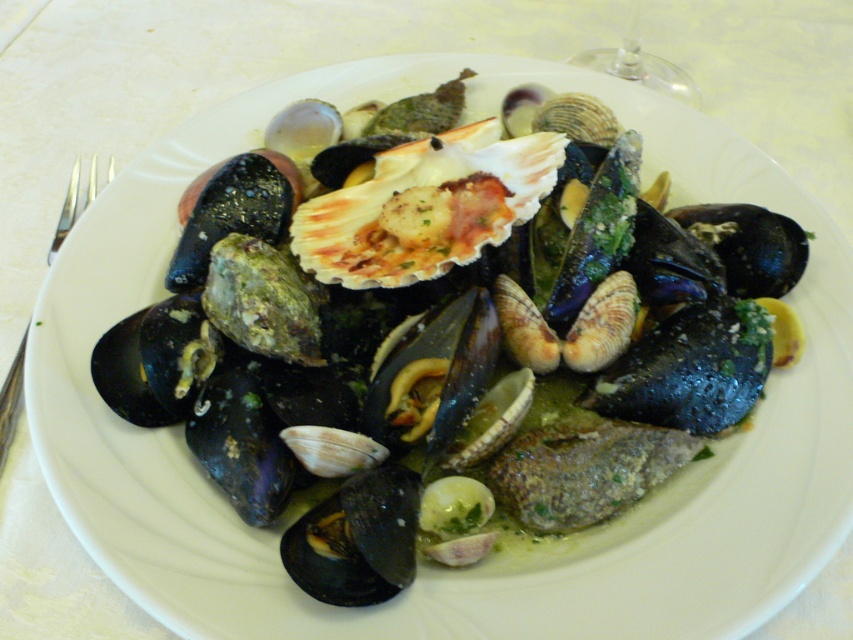
You are a waiter trying to place a napkin on the table. The napkin must be placed exactly at the center of the tablecloth. However, there is a transparent glass at upper right on the table. Where should you place the napkin so it doesn

The transparent glass at upper right is located at coordinates point (640, 65). To place the napkin at the center of the tablecloth without overlapping the glass, you should position it away from those coordinates towards the middle of the table.

You are a food critic evaluating this dish. You notice a point at coordinates [640,65] on the image. What object is located at this point?

The point at coordinates [640,65] indicates transparent glass at upper right.

You are a chef arranging ingredients on a plate. You have two points marked on your plate at coordinates point (647, 72) and point (76, 209). Which point is closer to the viewer when looking at the plate from above?

Point (647, 72) is further to the viewer than point (76, 209), so the point closer to the viewer is point (76, 209).